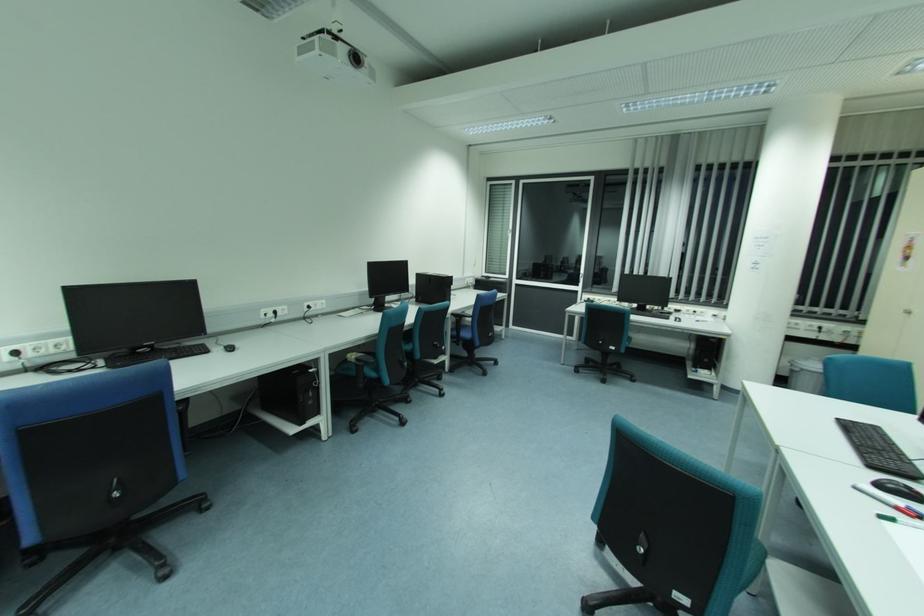
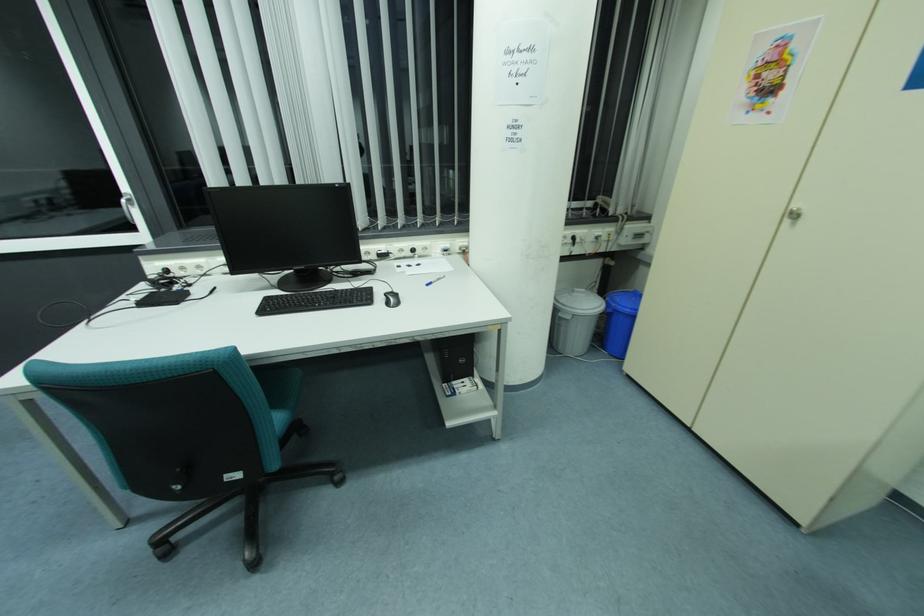
In the second image, find the point that corresponds to point 679,318 in the first image.

(396, 296)